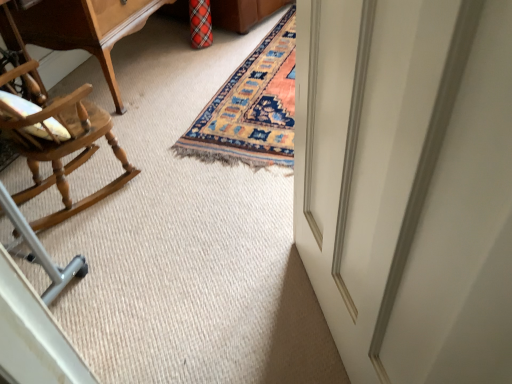
Question: Is point (333, 148) closer or farther from the camera than point (73, 132)?

Choices:
 (A) farther
 (B) closer

Answer: (B)

Question: Is white glossy door at right in front of or behind light brown wood rocking chair at left in the image?

Choices:
 (A) front
 (B) behind

Answer: (A)

Question: Based on their relative distances, which object is nearer to the wooden table at upper left?

Choices:
 (A) light brown wood rocking chair at left
 (B) white glossy door at right

Answer: (A)

Question: Which is nearer to the wooden table at upper left?

Choices:
 (A) light brown wood rocking chair at left
 (B) white glossy door at right

Answer: (A)